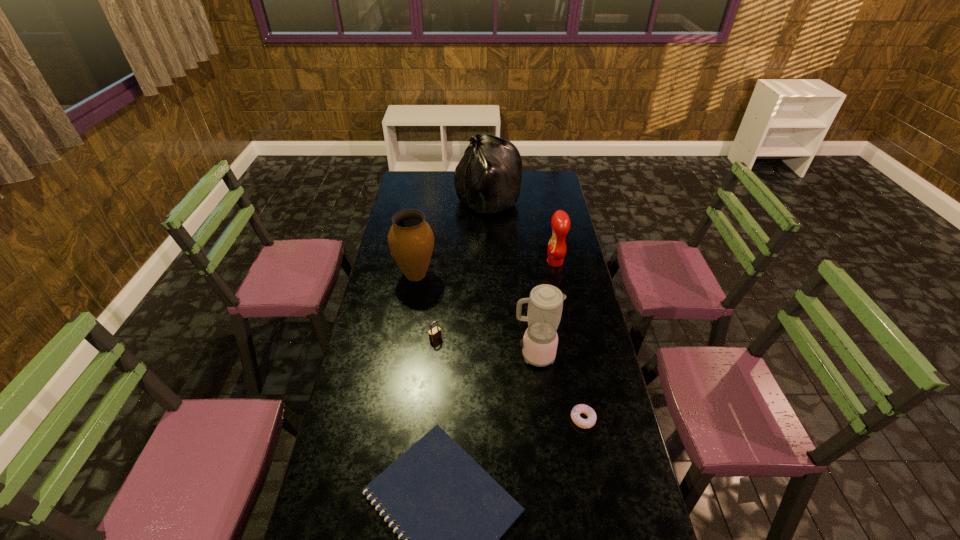
Locate an element on the screen. The image size is (960, 540). the tallest object is located at coordinates (488, 177).

I want to click on plastic bag, so click(488, 177).

You are a GUI agent. You are given a task and a screenshot of the screen. Output one action in this format:
    pyautogui.click(x=<x>, y=<y>)
    Task: Click on the food processor
    The image size is (960, 540).
    Given the screenshot: What is the action you would take?
    pyautogui.click(x=545, y=304)

Image resolution: width=960 pixels, height=540 pixels. Find the location of `urn`. urn is located at coordinates (411, 240).

This screenshot has height=540, width=960. Find the location of `the fourth shortest object`. the fourth shortest object is located at coordinates (560, 222).

Image resolution: width=960 pixels, height=540 pixels. Find the location of `padlock`. padlock is located at coordinates (435, 333).

Find the location of a particular element. doughnut is located at coordinates (581, 408).

The height and width of the screenshot is (540, 960). I want to click on free spot located on the left of the tallest object, so click(x=414, y=201).

This screenshot has height=540, width=960. Identify the location of vacant space located 0.190m on the base of the food processor near the control knob. (461, 355).

Locate an element on the screen. The image size is (960, 540). free region located on the base of the food processor near the control knob is located at coordinates [x=436, y=355].